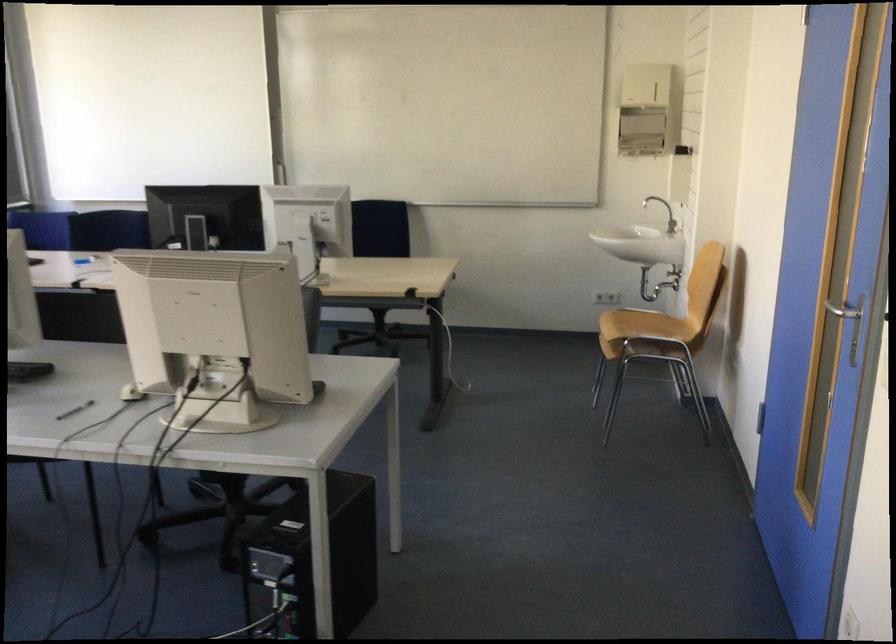
What do you see at coordinates (843, 310) in the screenshot? The width and height of the screenshot is (896, 644). I see `the silver door handle` at bounding box center [843, 310].